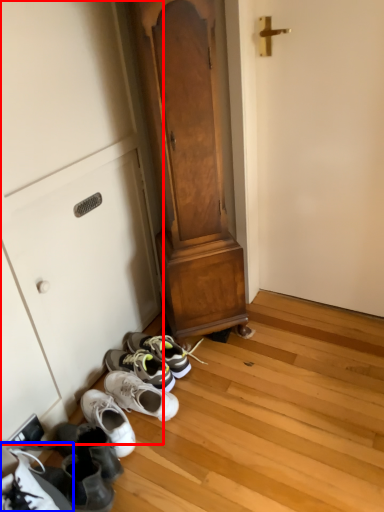
Question: Which object appears closest to the camera in this image, cabinetry (highlighted by a red box) or footwear (highlighted by a blue box)?

Choices:
 (A) cabinetry
 (B) footwear

Answer: (B)